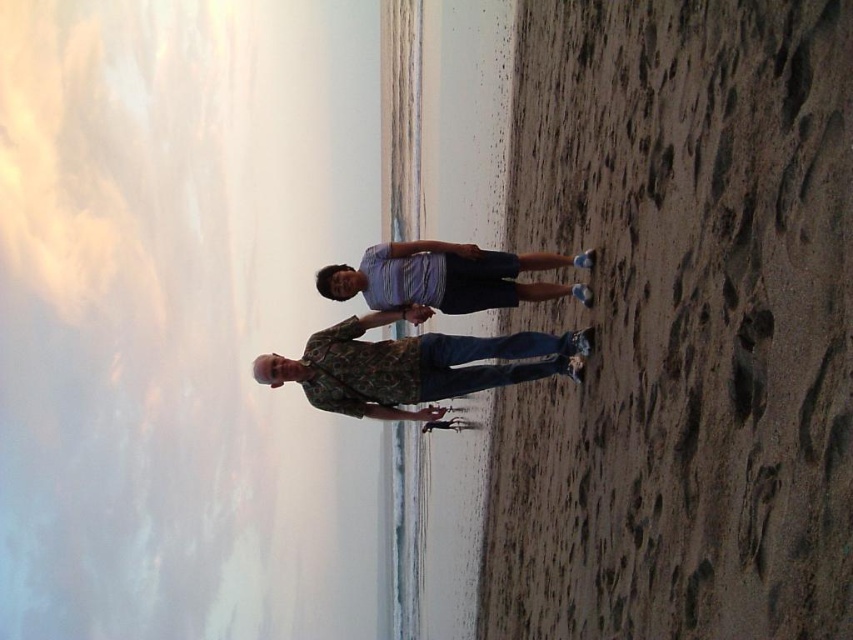
You are standing on the beach and see two points marked on the sand. The first point is at coordinates point (360, 401) and the second point is at point (440, 304). Which point is closer to you?

Point (360, 401) is closer to the viewer than point (440, 304).